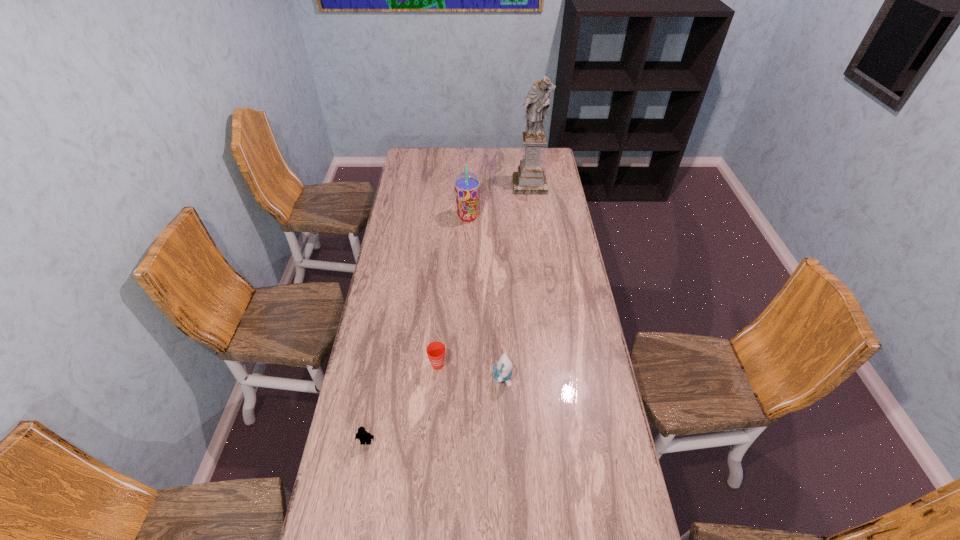
Locate an element on the screen. free point located on the face of the second object from right to left is located at coordinates (459, 377).

This screenshot has width=960, height=540. Find the location of `vacant area situated on the face of the second object from right to left`. vacant area situated on the face of the second object from right to left is located at coordinates (385, 377).

Locate an element on the screen. free space located on the face of the second object from right to left is located at coordinates (421, 377).

In order to click on vacant space positioned on the front of the cup in this screenshot , I will do `click(436, 391)`.

Image resolution: width=960 pixels, height=540 pixels. Identify the location of vacant area located on the face of the Lego. (351, 523).

What are the coordinates of `object that is at the left edge` in the screenshot? It's located at (362, 435).

Locate an element on the screen. This screenshot has width=960, height=540. object present at the right edge is located at coordinates (530, 179).

Identify the location of free spot at the left edge of the desktop. Image resolution: width=960 pixels, height=540 pixels. (403, 218).

Image resolution: width=960 pixels, height=540 pixels. What are the coordinates of `vacant space at the right edge of the desktop` in the screenshot? It's located at (584, 368).

This screenshot has height=540, width=960. I want to click on blank region between the smoothie and the Lego, so click(417, 329).